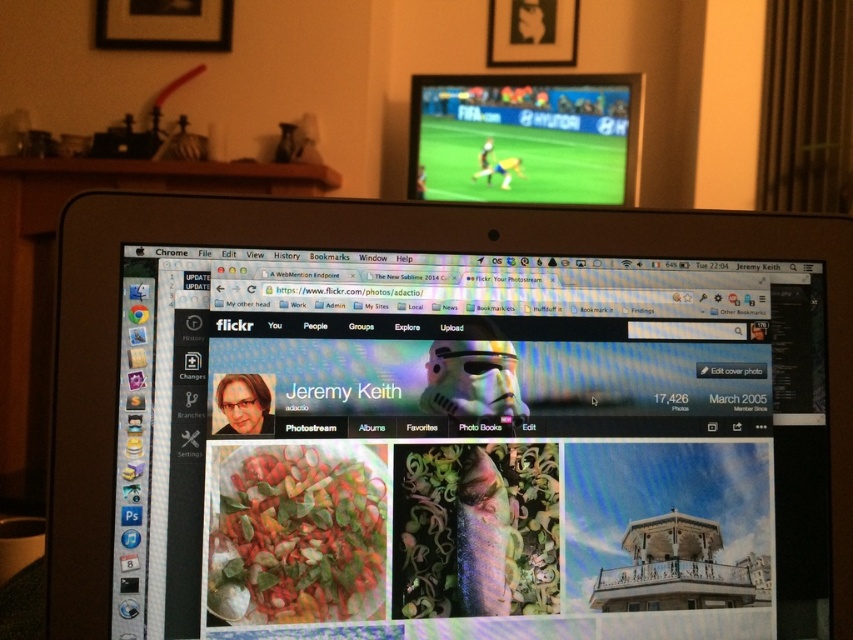
Question: Does satin black monitor at center have a lesser width compared to matte plastic tv at upper center?

Choices:
 (A) no
 (B) yes

Answer: (A)

Question: Which point is farther to the camera?

Choices:
 (A) (509, 81)
 (B) (136, 627)

Answer: (A)

Question: Is satin black monitor at center positioned behind matte plastic tv at upper center?

Choices:
 (A) no
 (B) yes

Answer: (A)

Question: Among these objects, which one is farthest from the camera?

Choices:
 (A) matte plastic tv at upper center
 (B) satin black monitor at center

Answer: (A)

Question: Considering the relative positions of satin black monitor at center and matte plastic tv at upper center in the image provided, where is satin black monitor at center located with respect to matte plastic tv at upper center?

Choices:
 (A) left
 (B) right

Answer: (A)